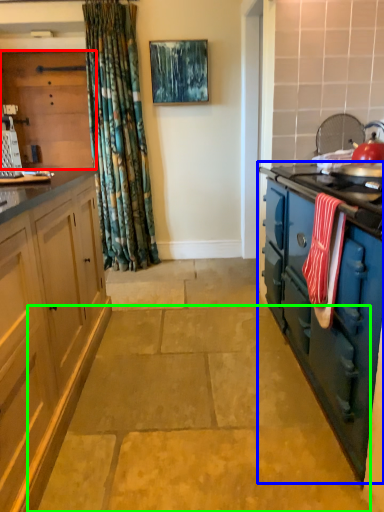
Question: Considering the real-world distances, which object is closest to cabinetry (highlighted by a red box)? cabinetry (highlighted by a blue box) or concrete (highlighted by a green box).

Choices:
 (A) cabinetry
 (B) concrete

Answer: (A)